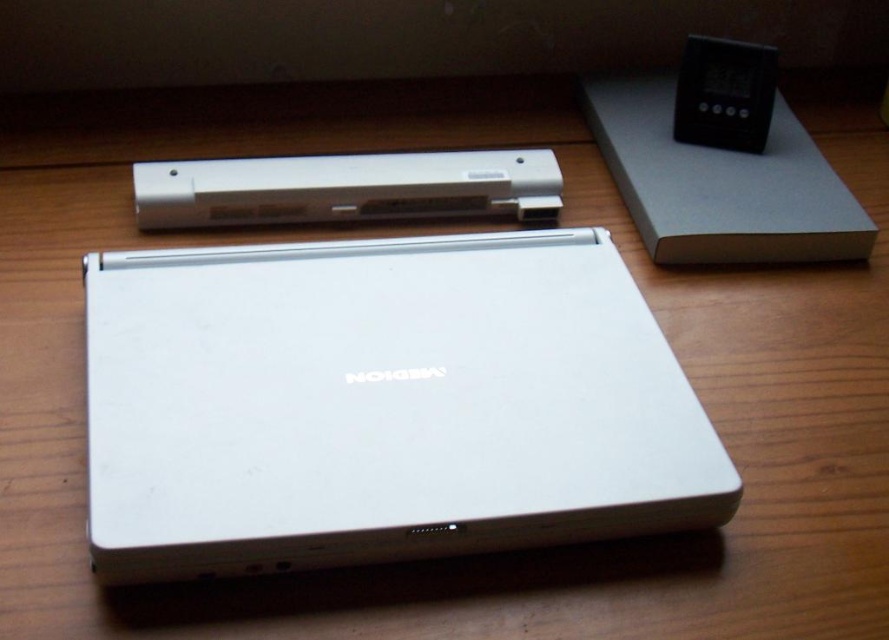
Question: Is white matte laptop at center in front of black plastic ipod at upper right?

Choices:
 (A) no
 (B) yes

Answer: (B)

Question: Among these objects, which one is nearest to the camera?

Choices:
 (A) white plastic speaker at upper center
 (B) white matte laptop at center

Answer: (B)

Question: Which point is farther to the camera?

Choices:
 (A) (565, 260)
 (B) (170, 220)
 (C) (725, 147)

Answer: (C)

Question: In this image, where is white matte laptop at center located relative to white plastic speaker at upper center?

Choices:
 (A) above
 (B) below

Answer: (B)

Question: Which point is closer to the camera?

Choices:
 (A) white plastic speaker at upper center
 (B) black plastic ipod at upper right

Answer: (A)

Question: From the image, what is the correct spatial relationship of white matte laptop at center in relation to black plastic ipod at upper right?

Choices:
 (A) above
 (B) below

Answer: (B)